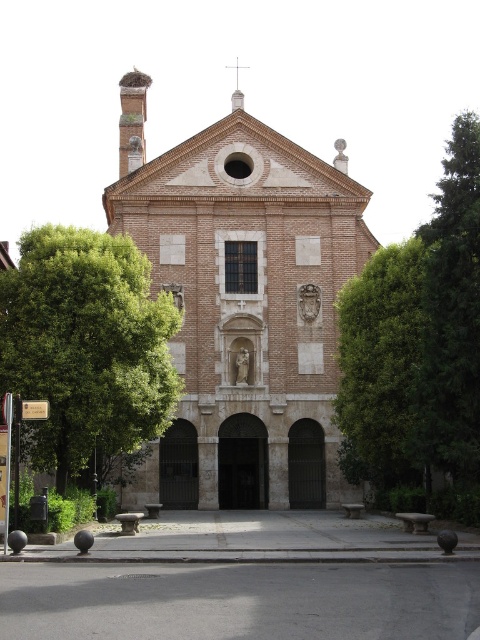
Question: Can you confirm if brown brick chapel at center is positioned below green leafy tree at center?

Choices:
 (A) yes
 (B) no

Answer: (B)

Question: Does brown brick chapel at center appear under green leafy tree at center?

Choices:
 (A) no
 (B) yes

Answer: (A)

Question: Considering the real-world distances, which object is closest to the brown brick chapel at center?

Choices:
 (A) green leafy tree at right
 (B) green leafy tree at center

Answer: (B)

Question: Which is farther from the brown brick chapel at center?

Choices:
 (A) green leafy tree at center
 (B) green leafy tree at right

Answer: (B)

Question: Can you confirm if brown brick chapel at center is bigger than green leafy tree at right?

Choices:
 (A) no
 (B) yes

Answer: (B)

Question: Which of the following is the closest to the observer?

Choices:
 (A) (344, 385)
 (B) (40, 371)

Answer: (B)